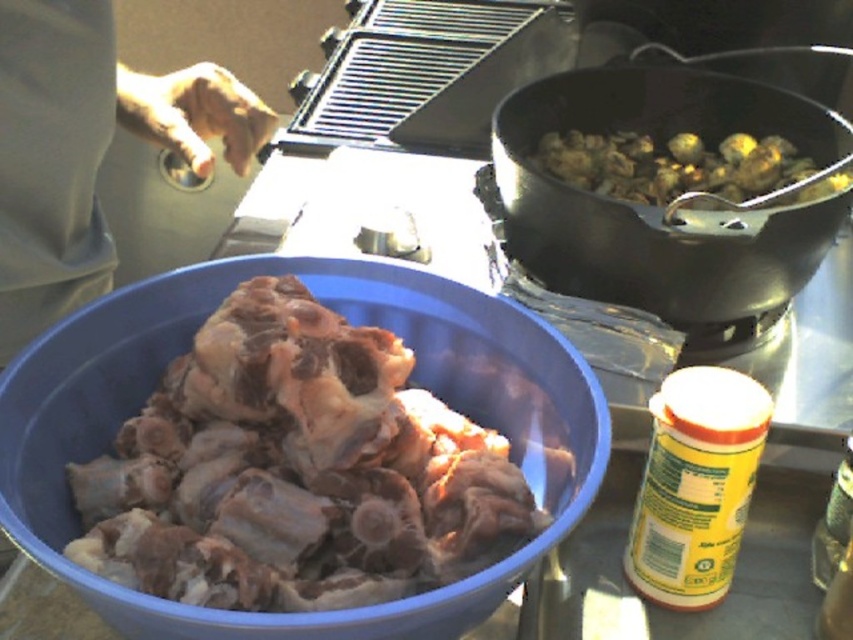
Question: Which object appears closest to the camera in this image?

Choices:
 (A) black matte wok at upper right
 (B) brown skin at upper left
 (C) brown matte bone at center

Answer: (C)

Question: Does brown matte bone at center lie behind black matte wok at upper right?

Choices:
 (A) no
 (B) yes

Answer: (A)

Question: Which of the following is the closest to the observer?

Choices:
 (A) (107, 248)
 (B) (614, 132)

Answer: (A)

Question: Does brown skin at upper left come in front of golden brown mushrooms at upper right?

Choices:
 (A) no
 (B) yes

Answer: (B)

Question: Which object is the farthest from the golden brown mushrooms at upper right?

Choices:
 (A) brown matte bone at center
 (B) black matte wok at upper right

Answer: (A)

Question: Can you confirm if brown matte bone at center is positioned to the left of brown skin at upper left?

Choices:
 (A) no
 (B) yes

Answer: (A)